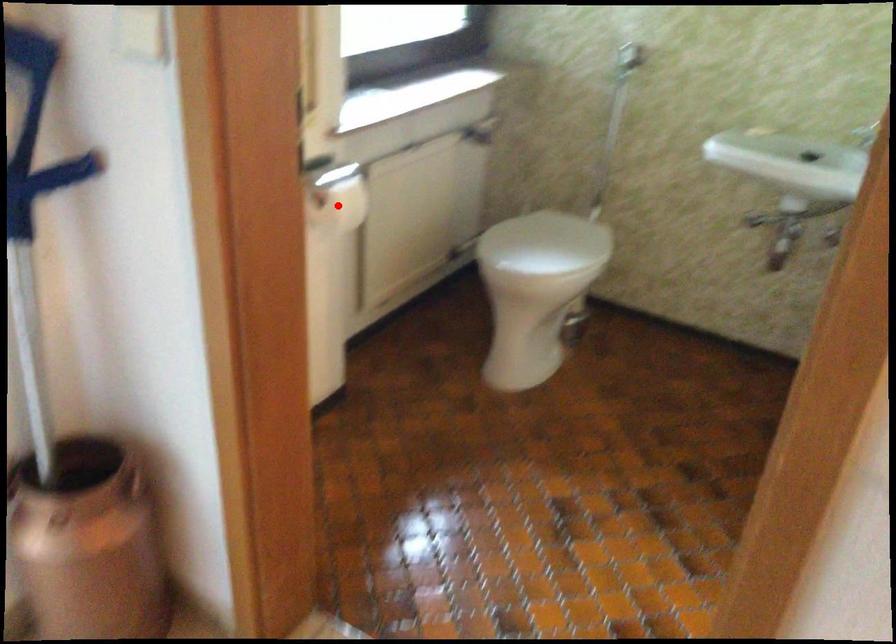
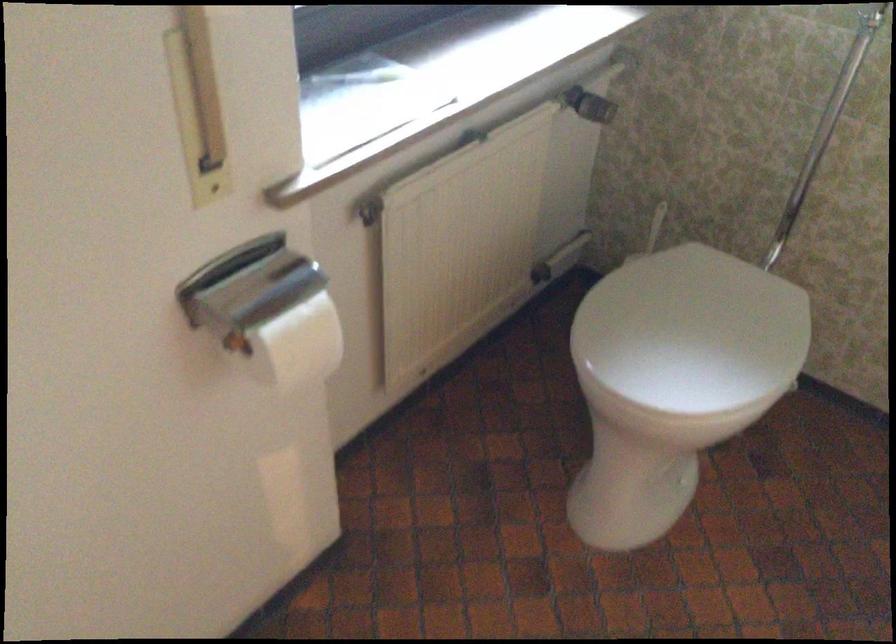
Question: I am providing you with two images of the same scene from different viewpoints. A red point is shown in image1. For the corresponding object point in image2, is it positioned nearer or farther from the camera?

Choices:
 (A) Nearer
 (B) Farther

Answer: (A)